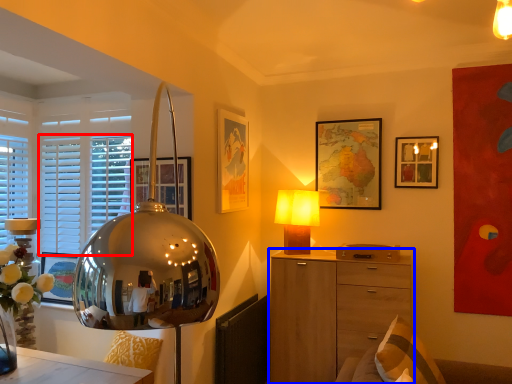
Question: Which object appears farthest to the camera in this image, blind (highlighted by a red box) or chest of drawers (highlighted by a blue box)?

Choices:
 (A) blind
 (B) chest of drawers

Answer: (A)